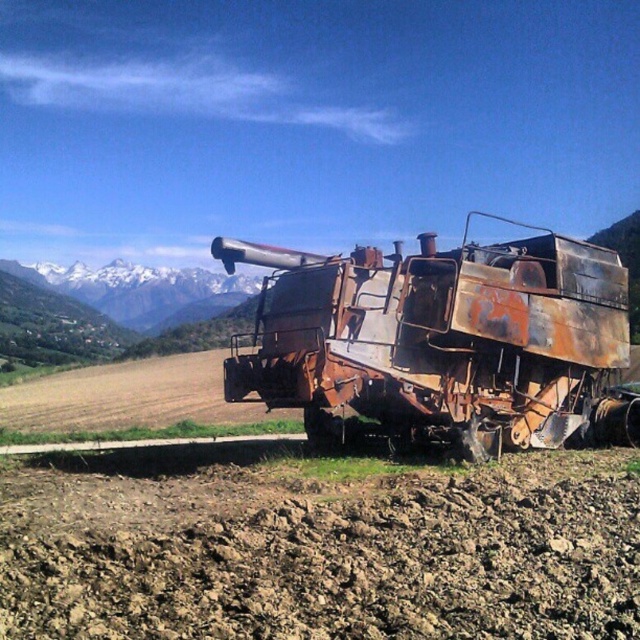
Question: Which of the following is the closest to the observer?

Choices:
 (A) rusty metal trailer truck at center
 (B) white snow-covered mountain at upper left

Answer: (A)

Question: Does rusty metal trailer truck at center lie in front of white snow-covered mountain at upper left?

Choices:
 (A) yes
 (B) no

Answer: (A)

Question: Is rusty metal trailer truck at center wider than white snow-covered mountain at upper left?

Choices:
 (A) yes
 (B) no

Answer: (A)

Question: Is rusty metal trailer truck at center to the right of white snow-covered mountain at upper left from the viewer's perspective?

Choices:
 (A) yes
 (B) no

Answer: (A)